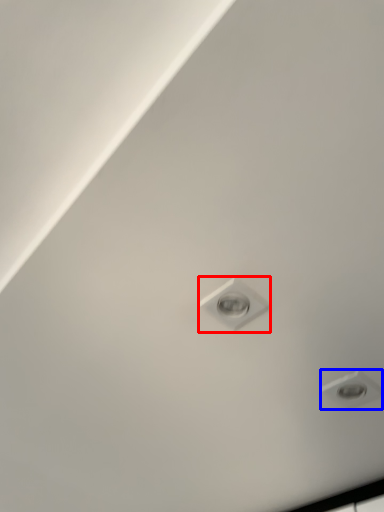
Question: Which object appears farthest to the camera in this image, light bulb (highlighted by a red box) or droplight (highlighted by a blue box)?

Choices:
 (A) light bulb
 (B) droplight

Answer: (B)